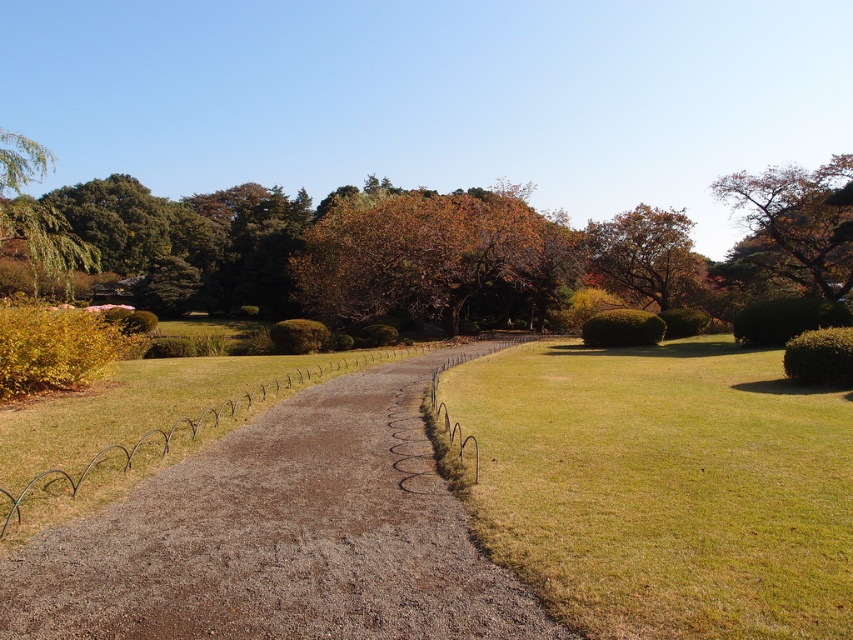
Between point (3, 346) and point (692, 321), which one is positioned in front?

Point (3, 346)

Where is `yellow-green leafy bush at left`? The height and width of the screenshot is (640, 853). yellow-green leafy bush at left is located at coordinates (56, 348).

In order to click on yellow-green leafy bush at left in this screenshot , I will do `click(56, 348)`.

Who is more distant from viewer, (811,374) or (635,339)?

Positioned behind is point (635,339).

Is green leafy bush at right taller than green leafy bush at center?

In fact, green leafy bush at right may be shorter than green leafy bush at center.

Who is more forward, (840, 385) or (614, 346)?

Point (840, 385) is in front.

The image size is (853, 640). Find the location of `green leafy bush at right`. green leafy bush at right is located at coordinates (820, 356).

Does green grass at center have a smaller size compared to brown gravel path at center?

Actually, green grass at center might be larger than brown gravel path at center.

Who is more forward, (724,397) or (109,628)?

Point (109,628) is in front.

Between point (784, 602) and point (103, 600), which one is positioned behind?

Positioned behind is point (103, 600).

Identify the location of green grass at center. The width and height of the screenshot is (853, 640). [660, 486].